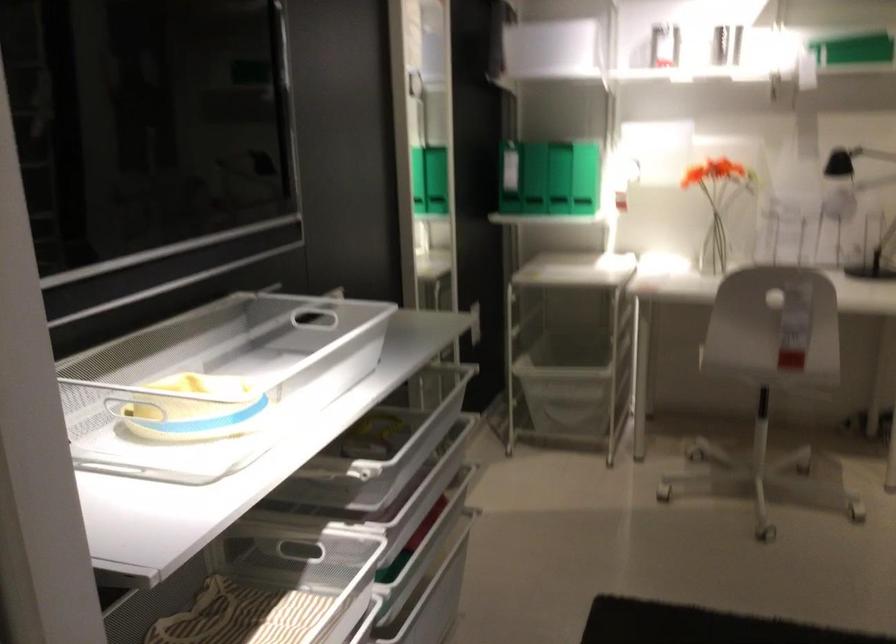
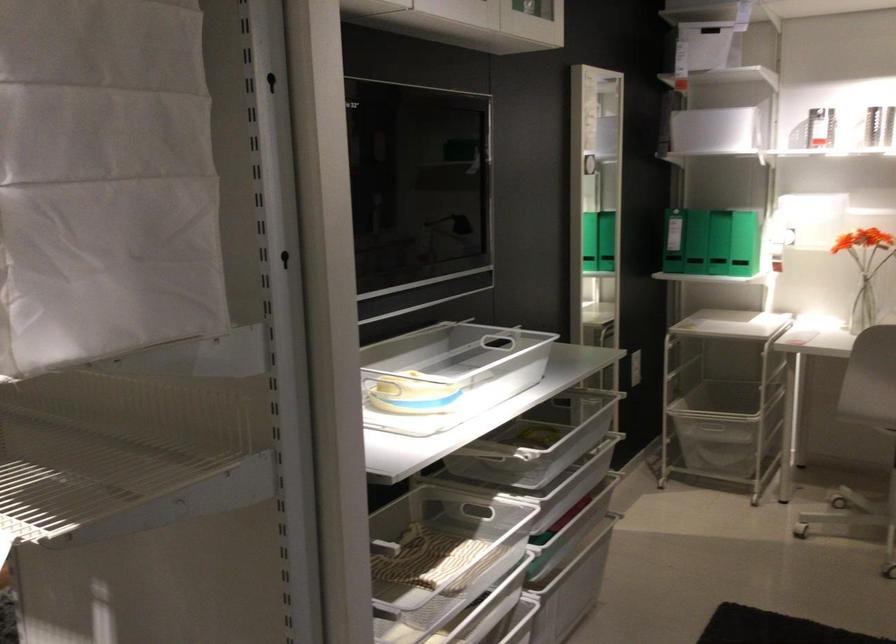
Where in the second image is the point corresponding to [695,252] from the first image?

(864, 308)